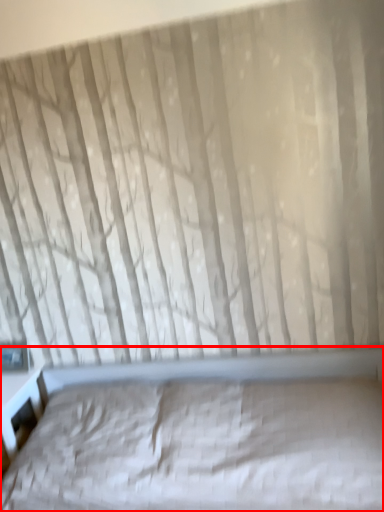
Question: From the image's perspective, where is bed (annotated by the red box) located in relation to window in the image?

Choices:
 (A) below
 (B) above

Answer: (A)